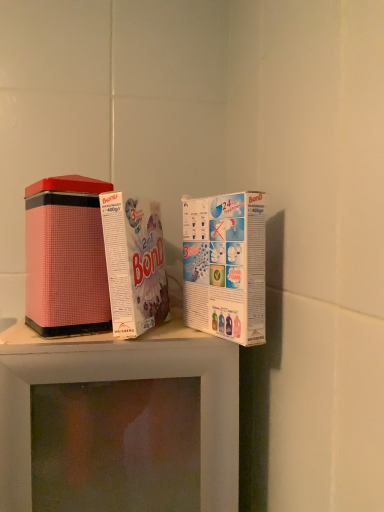
What are the coordinates of `white cardboard box at upper right, placed as the 1th product when sorted from right to left` in the screenshot? It's located at (225, 266).

Find the location of a particular element. The height and width of the screenshot is (512, 384). pink matte tin at center, the 2th product when ordered from left to right is located at coordinates (134, 263).

Is pink matte tin can at left, which is counted as the 3th product, starting from the right, next to white cardboard box at upper right, which is counted as the 3th product, starting from the left?

No.

Does point (68, 177) come farther from viewer compared to point (238, 331)?

Yes.

Which object is wider, pink matte tin can at left, positioned as the 1th product in left-to-right order, or white cardboard box at upper right, which is counted as the 3th product, starting from the left?

Wider between the two is pink matte tin can at left, positioned as the 1th product in left-to-right order.

From the image's perspective, is pink matte tin can at left, positioned as the 1th product in left-to-right order, over white cardboard box at upper right, which is counted as the 3th product, starting from the left?

Yes, from the image's perspective, pink matte tin can at left, positioned as the 1th product in left-to-right order, is above white cardboard box at upper right, which is counted as the 3th product, starting from the left.

Which is behind, point (110, 263) or point (57, 204)?

The point (110, 263) is more distant.

Is pink matte tin at center, the 2th product when ordered from left to right, to the left or to the right of pink matte tin can at left, which is counted as the 3th product, starting from the right, in the image?

Clearly, pink matte tin at center, the 2th product when ordered from left to right, is on the right of pink matte tin can at left, which is counted as the 3th product, starting from the right, in the image.

At what (x,y) coordinates should I click in order to perform the action: click on product above the pink matte tin can at left, which is counted as the 3th product, starting from the right (from the image's perspective). Please return your answer as a coordinate pair (x, y). This screenshot has height=512, width=384. Looking at the image, I should click on (134, 263).

Consider the image. Can you tell me how much pink matte tin at center, the second product from the right, and pink matte tin can at left, which is counted as the 3th product, starting from the right, differ in facing direction?

The facing directions of pink matte tin at center, the second product from the right, and pink matte tin can at left, which is counted as the 3th product, starting from the right, are 23.5 degrees apart.

Is pink matte tin can at left, positioned as the 1th product in left-to-right order, to the left of pink matte tin at center, the second product from the right, from the viewer's perspective?

Indeed, pink matte tin can at left, positioned as the 1th product in left-to-right order, is positioned on the left side of pink matte tin at center, the second product from the right.

Considering the sizes of objects pink matte tin can at left, which is counted as the 3th product, starting from the right, and pink matte tin at center, the 2th product when ordered from left to right, in the image provided, who is smaller, pink matte tin can at left, which is counted as the 3th product, starting from the right, or pink matte tin at center, the 2th product when ordered from left to right,?

With smaller size is pink matte tin at center, the 2th product when ordered from left to right.

Find the location of a particular element. Image resolution: width=384 pixels, height=512 pixels. product behind the pink matte tin at center, the 2th product when ordered from left to right is located at coordinates (65, 257).

From the image's perspective, is pink matte tin can at left, which is counted as the 3th product, starting from the right, located above or below pink matte tin at center, the second product from the right?

pink matte tin can at left, which is counted as the 3th product, starting from the right, is below pink matte tin at center, the second product from the right.

I want to click on product on the right of pink matte tin at center, the 2th product when ordered from left to right, so click(225, 266).

Is pink matte tin at center, the second product from the right, located within white cardboard box at upper right, which is counted as the 3th product, starting from the left?

No, pink matte tin at center, the second product from the right, is located outside of white cardboard box at upper right, which is counted as the 3th product, starting from the left.

Is white cardboard box at upper right, placed as the 1th product when sorted from right to left, not near pink matte tin at center, the 2th product when ordered from left to right?

white cardboard box at upper right, placed as the 1th product when sorted from right to left, is actually quite close to pink matte tin at center, the 2th product when ordered from left to right.

Considering the sizes of objects white cardboard box at upper right, placed as the 1th product when sorted from right to left, and pink matte tin at center, the second product from the right, in the image provided, who is smaller, white cardboard box at upper right, placed as the 1th product when sorted from right to left, or pink matte tin at center, the second product from the right,?

Smaller between the two is white cardboard box at upper right, placed as the 1th product when sorted from right to left.

Is white cardboard box at upper right, placed as the 1th product when sorted from right to left, positioned before pink matte tin can at left, which is counted as the 3th product, starting from the right?

Yes, the depth of white cardboard box at upper right, placed as the 1th product when sorted from right to left, is less than that of pink matte tin can at left, which is counted as the 3th product, starting from the right.

Between white cardboard box at upper right, which is counted as the 3th product, starting from the left, and pink matte tin can at left, which is counted as the 3th product, starting from the right, which one has larger size?

pink matte tin can at left, which is counted as the 3th product, starting from the right, is bigger.

Can pink matte tin can at left, which is counted as the 3th product, starting from the right, be found inside white cardboard box at upper right, which is counted as the 3th product, starting from the left?

No, pink matte tin can at left, which is counted as the 3th product, starting from the right, is not surrounded by white cardboard box at upper right, which is counted as the 3th product, starting from the left.

How far apart are white cardboard box at upper right, placed as the 1th product when sorted from right to left, and pink matte tin can at left, positioned as the 1th product in left-to-right order?

The distance of white cardboard box at upper right, placed as the 1th product when sorted from right to left, from pink matte tin can at left, positioned as the 1th product in left-to-right order, is 7.29 inches.

From a real-world perspective, is pink matte tin at center, the second product from the right, below white cardboard box at upper right, placed as the 1th product when sorted from right to left?

No, from a real-world perspective, pink matte tin at center, the second product from the right, is not under white cardboard box at upper right, placed as the 1th product when sorted from right to left.

Which is behind, point (127, 284) or point (250, 305)?

The point (127, 284) is farther from the camera.

From the image's perspective, who appears lower, pink matte tin at center, the 2th product when ordered from left to right, or white cardboard box at upper right, which is counted as the 3th product, starting from the left?

white cardboard box at upper right, which is counted as the 3th product, starting from the left, is shown below in the image.

Could you measure the distance between pink matte tin at center, the 2th product when ordered from left to right, and white cardboard box at upper right, placed as the 1th product when sorted from right to left?

A distance of 3.43 inches exists between pink matte tin at center, the 2th product when ordered from left to right, and white cardboard box at upper right, placed as the 1th product when sorted from right to left.

Locate an element on the screen. the 1st product positioned above the white cardboard box at upper right, placed as the 1th product when sorted from right to left (from the image's perspective) is located at coordinates (65, 257).

From a real-world perspective, starting from the pink matte tin at center, the second product from the right, which product is the 1st one below it? Please provide its 2D coordinates.

[(65, 257)]

Based on their spatial positions, is pink matte tin at center, the second product from the right, or pink matte tin can at left, positioned as the 1th product in left-to-right order, further from white cardboard box at upper right, placed as the 1th product when sorted from right to left?

pink matte tin can at left, positioned as the 1th product in left-to-right order.

Based on their spatial positions, is pink matte tin at center, the 2th product when ordered from left to right, or white cardboard box at upper right, placed as the 1th product when sorted from right to left, closer to pink matte tin can at left, which is counted as the 3th product, starting from the right?

pink matte tin at center, the 2th product when ordered from left to right.

Which object lies nearer to the anchor point white cardboard box at upper right, placed as the 1th product when sorted from right to left, pink matte tin can at left, which is counted as the 3th product, starting from the right, or pink matte tin at center, the second product from the right?

Based on the image, pink matte tin at center, the second product from the right, appears to be nearer to white cardboard box at upper right, placed as the 1th product when sorted from right to left.

From the image, which object appears to be farther from pink matte tin can at left, which is counted as the 3th product, starting from the right, white cardboard box at upper right, placed as the 1th product when sorted from right to left, or pink matte tin at center, the second product from the right?

white cardboard box at upper right, placed as the 1th product when sorted from right to left, is positioned further to the anchor pink matte tin can at left, which is counted as the 3th product, starting from the right.

When comparing their distances from pink matte tin at center, the second product from the right, does pink matte tin can at left, which is counted as the 3th product, starting from the right, or white cardboard box at upper right, placed as the 1th product when sorted from right to left, seem closer?

Based on the image, white cardboard box at upper right, placed as the 1th product when sorted from right to left, appears to be nearer to pink matte tin at center, the second product from the right.

Considering their positions, is white cardboard box at upper right, placed as the 1th product when sorted from right to left, positioned further to pink matte tin at center, the second product from the right, than pink matte tin can at left, which is counted as the 3th product, starting from the right?

pink matte tin can at left, which is counted as the 3th product, starting from the right.

Locate an element on the screen. This screenshot has width=384, height=512. product between pink matte tin can at left, positioned as the 1th product in left-to-right order, and white cardboard box at upper right, placed as the 1th product when sorted from right to left, in the horizontal direction is located at coordinates (134, 263).